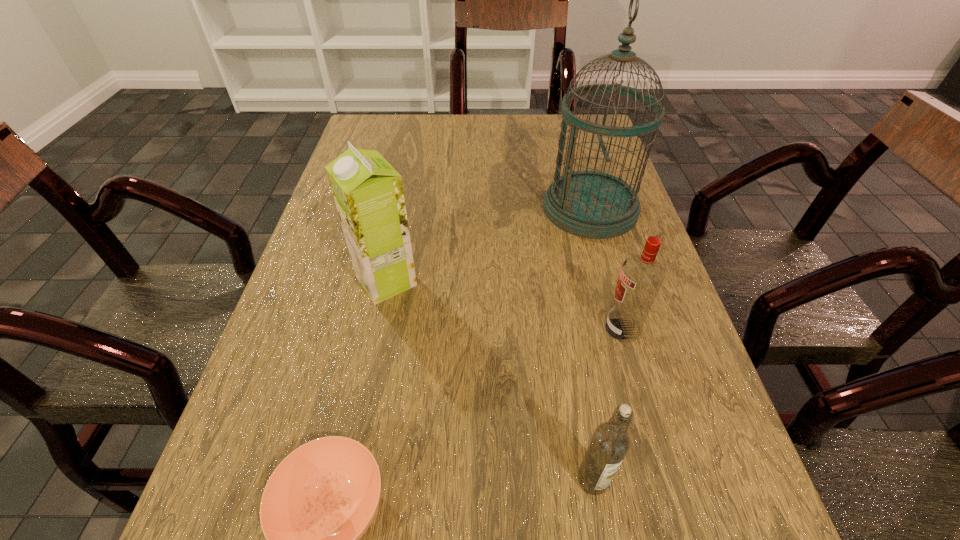
You are a GUI agent. You are given a task and a screenshot of the screen. Output one action in this format:
    pyautogui.click(x=<x>, y=<y>)
    Task: Click on the vacant space situated 0.150m on the front of the soya milk
    The height and width of the screenshot is (540, 960).
    Given the screenshot: What is the action you would take?
    pyautogui.click(x=368, y=373)

Where is `free space located on the front label of the farther vodka`? free space located on the front label of the farther vodka is located at coordinates (527, 329).

At what (x,y) coordinates should I click in order to perform the action: click on blank area located 0.220m on the front label of the farther vodka. Please return your answer as a coordinate pair (x, y). The height and width of the screenshot is (540, 960). Looking at the image, I should click on (483, 329).

Image resolution: width=960 pixels, height=540 pixels. In order to click on blank space located on the front label of the farther vodka in this screenshot , I will do `click(440, 329)`.

I want to click on object positioned at the left edge, so click(368, 192).

Identify the location of birdcage that is at the right edge. The height and width of the screenshot is (540, 960). (591, 204).

This screenshot has height=540, width=960. What are the coordinates of `vodka that is at the right edge` in the screenshot? It's located at (641, 276).

Locate an element on the screen. Image resolution: width=960 pixels, height=540 pixels. vacant space at the far edge of the desktop is located at coordinates (463, 115).

At what (x,y) coordinates should I click in order to perform the action: click on free space at the left edge of the desktop. Please return your answer as a coordinate pair (x, y). This screenshot has height=540, width=960. Looking at the image, I should click on point(298,441).

Locate an element on the screen. The image size is (960, 540). free region at the right edge of the desktop is located at coordinates pos(650,373).